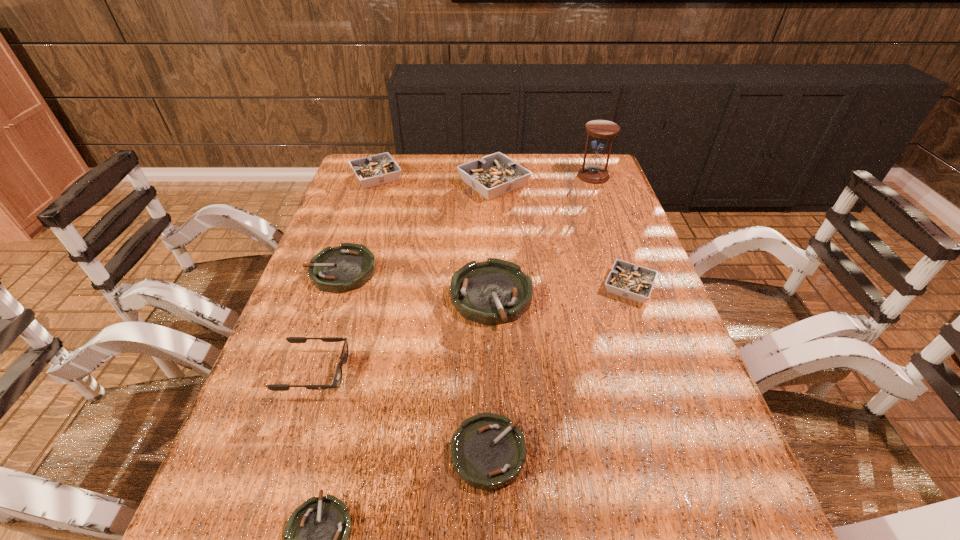
Where is `hourglass`? This screenshot has width=960, height=540. hourglass is located at coordinates (593, 172).

The width and height of the screenshot is (960, 540). Identify the location of the second tallest object. (494, 175).

Identify the location of the tallest ashtray. The width and height of the screenshot is (960, 540). (494, 175).

Find the location of a particular element. The image size is (960, 540). the leftmost gray ashtray is located at coordinates (378, 169).

Locate an element on the screen. This screenshot has width=960, height=540. the biggest green ashtray is located at coordinates (493, 292).

Locate an element on the screen. The height and width of the screenshot is (540, 960). sunglasses is located at coordinates click(337, 380).

This screenshot has width=960, height=540. I want to click on the nearest gray ashtray, so click(x=627, y=280).

You are a GUI agent. You are given a task and a screenshot of the screen. Output one action in this format:
    pyautogui.click(x=<x>, y=<y>)
    Task: Click on the rightmost gray ashtray
    
    Given the screenshot: What is the action you would take?
    pyautogui.click(x=627, y=280)

Where is `the second biggest green ashtray`? the second biggest green ashtray is located at coordinates (347, 267).

The height and width of the screenshot is (540, 960). In order to click on the sixth farthest ashtray in this screenshot , I will do [x=488, y=451].